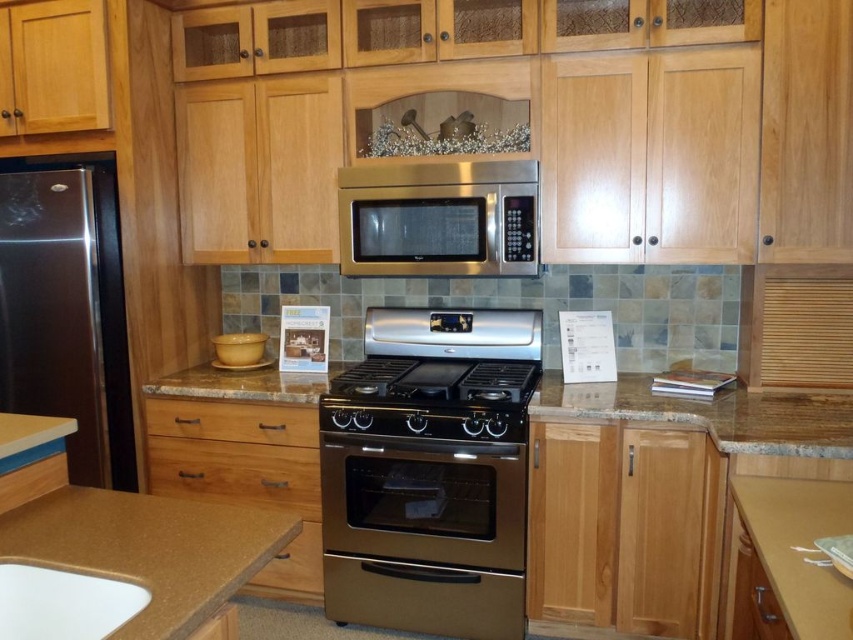
You are standing in the kitchen and want to place a new appliance next to the satin stainless steel refrigerator at left. What are the coordinates where you should place it?

The coordinates for the satin stainless steel refrigerator at left are at point (67,310), so you should place the new appliance near those coordinates.

You are standing in the kitchen and want to reach both the point at coordinates [45,275] and the point at [184,417]. Which point will you need to stretch your arm further to reach?

The point at coordinates [184,417] requires stretching your arm further because it is farther from the viewer compared to the point at [45,275].

You are a chef preparing to place a large pot on the stove. You see the stainless steel oven at center and the stainless steel microwave at center. Which appliance is located to the left of the other?

The stainless steel oven at center is positioned on the left side of the stainless steel microwave at center, so the oven is to the left of the microwave.